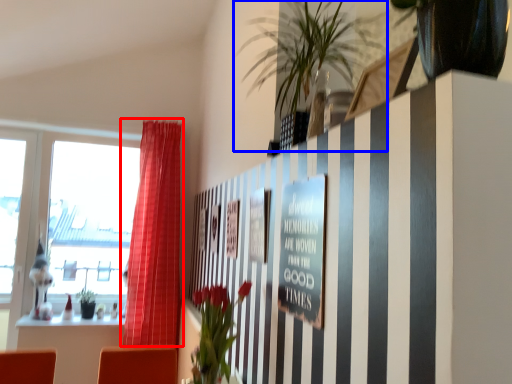
Question: Which point is closer to the camera, curtain (highlighted by a red box) or houseplant (highlighted by a blue box)?

Choices:
 (A) curtain
 (B) houseplant

Answer: (B)